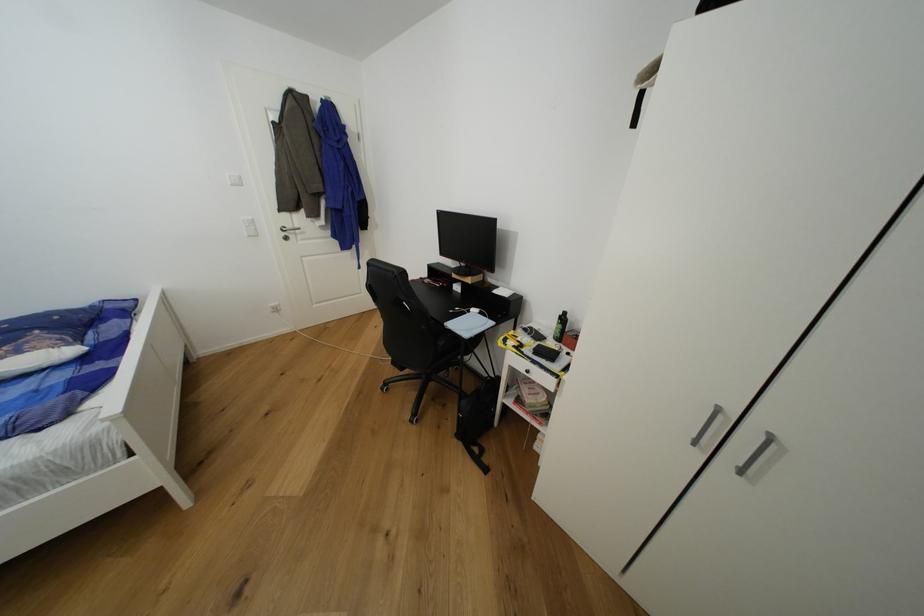
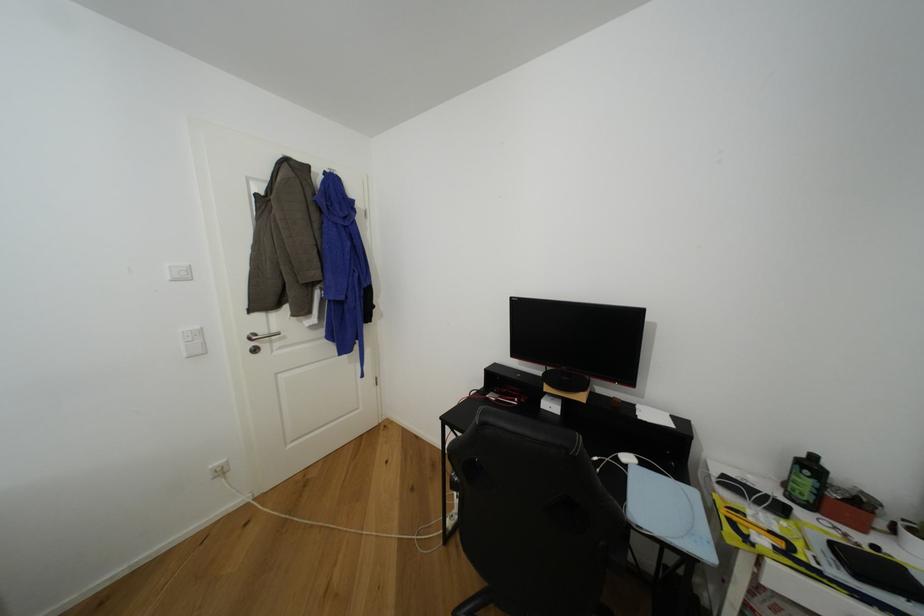
Where in the second image is the point corresponding to point 570,315 from the first image?

(820, 459)